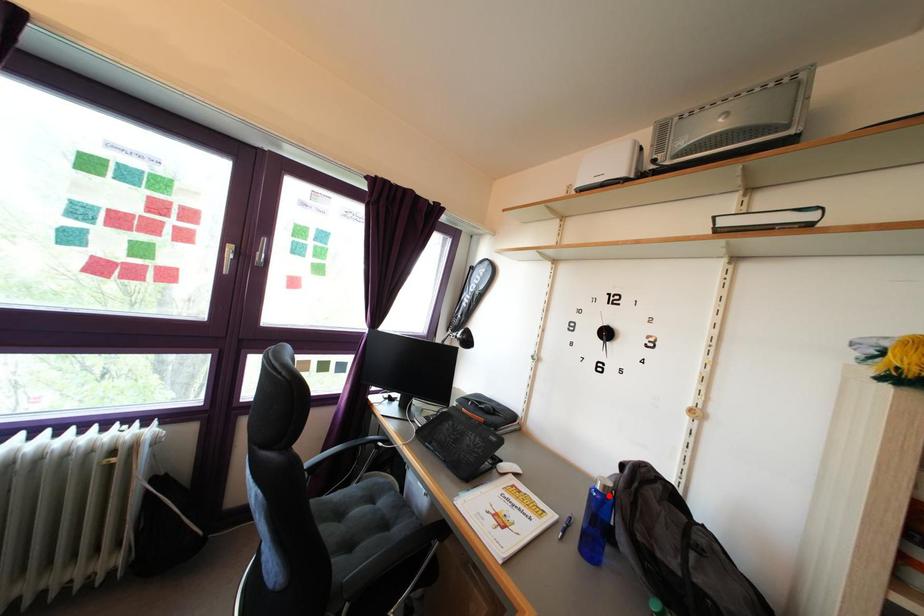
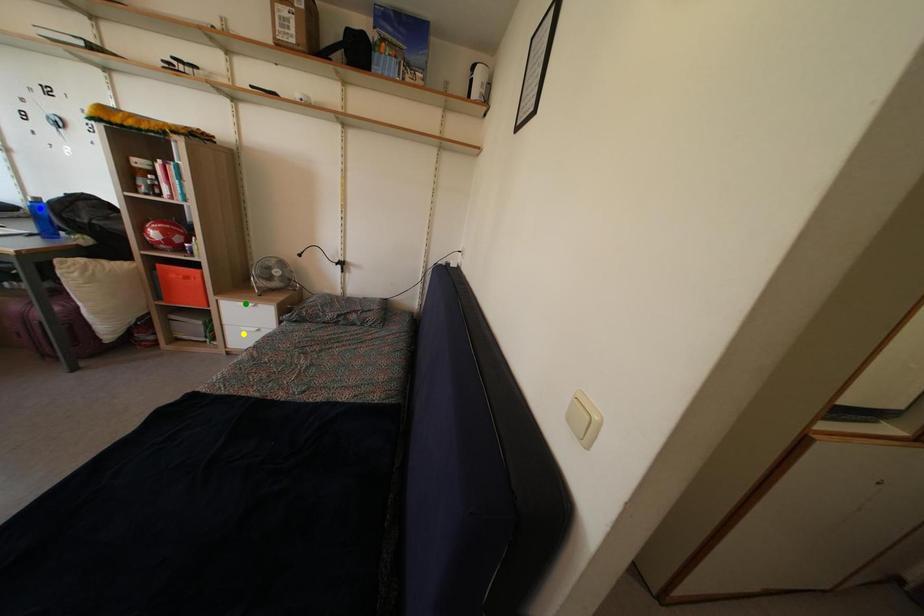
Question: I am providing you with two images of the same scene from different viewpoints. A red point is marked on the first image. You are given multiple points on the second image. Which spot in image 2 lines up with the point in image 1?

Choices:
 (A) blue point
 (B) yellow point
 (C) green point

Answer: (A)